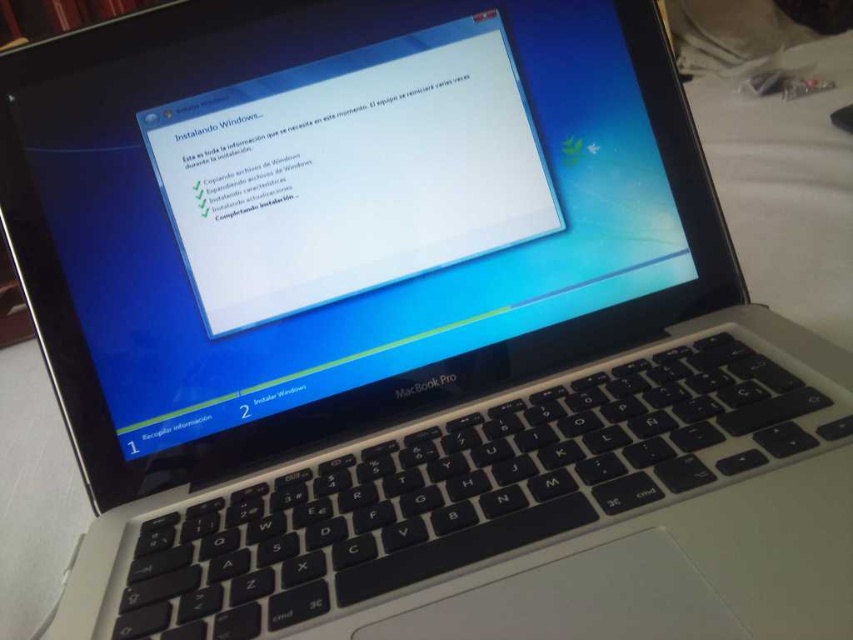
Which is more to the right, white glossy screen at center or white fabric at lower right?

white fabric at lower right

From the picture: Is white glossy screen at center closer to the viewer compared to white fabric at lower right?

That is True.

Does point (358, 60) come farther from viewer compared to point (778, 61)?

No, (358, 60) is in front of (778, 61).

Where is `white glossy screen at center`? white glossy screen at center is located at coordinates (351, 172).